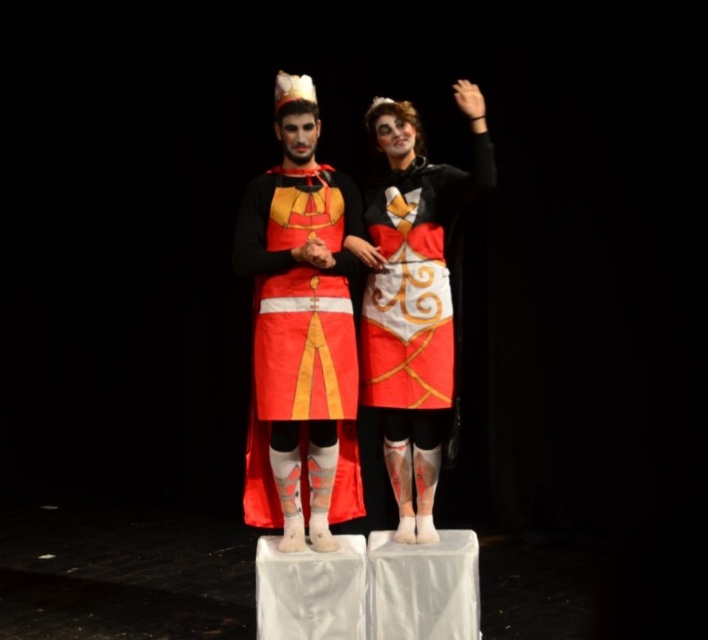
You are a photographer adjusting your camera settings. You notice two points in the image at coordinates point (268, 236) and point (326, 260). Which point is closer to your camera lens?

Point (268, 236) is further to the camera than point (326, 260), so the point closer to the camera lens is point (326, 260).

Consider the image. You are an observer looking at the two people in the image. You notice the matte red fabric cape at center and the matte black hand at center. Which object is located to the left of the other?

The matte red fabric cape at center is positioned on the left side of matte black hand at center.

You are an observer looking at the two costumed individuals. You notice the matte red fabric cape at center and the matte black hand at center. Which object is positioned lower in the image?

The matte red fabric cape at center is positioned below the matte black hand at center, so the matte red fabric cape at center is lower.